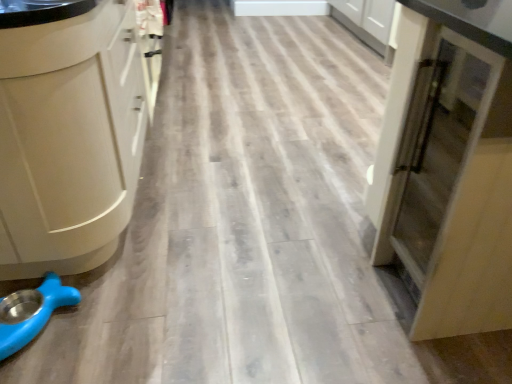
Question: In terms of height, does matte white cabinet at left look taller or shorter compared to blue rubber pet bowl at lower left?

Choices:
 (A) tall
 (B) short

Answer: (A)

Question: In the image, is matte white cabinet at left positioned in front of or behind blue rubber pet bowl at lower left?

Choices:
 (A) behind
 (B) front

Answer: (B)

Question: Which of these objects is positioned farthest from the matte wood cupboard at right?

Choices:
 (A) matte white cabinet at left
 (B) blue rubber pet bowl at lower left

Answer: (B)

Question: Estimate the real-world distances between objects in this image. Which object is closer to the matte wood cupboard at right?

Choices:
 (A) blue rubber pet bowl at lower left
 (B) matte white cabinet at left

Answer: (B)